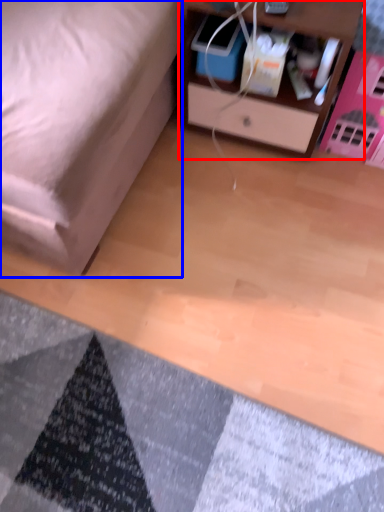
Question: Among these objects, which one is farthest to the camera, nightstand (highlighted by a red box) or furniture (highlighted by a blue box)?

Choices:
 (A) nightstand
 (B) furniture

Answer: (A)